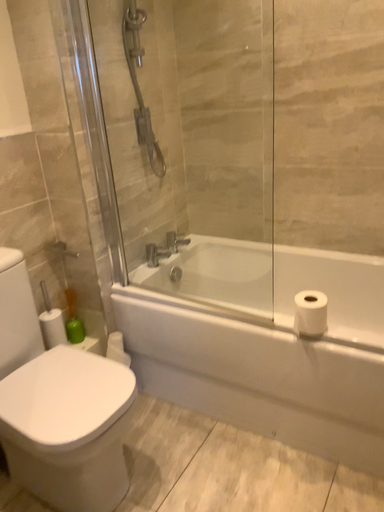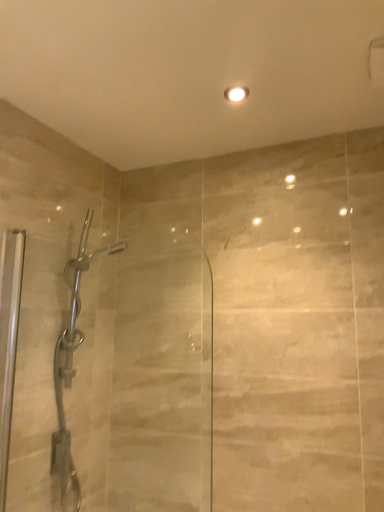
Question: Which way did the camera rotate in the video?

Choices:
 (A) rotated right
 (B) rotated left

Answer: (A)